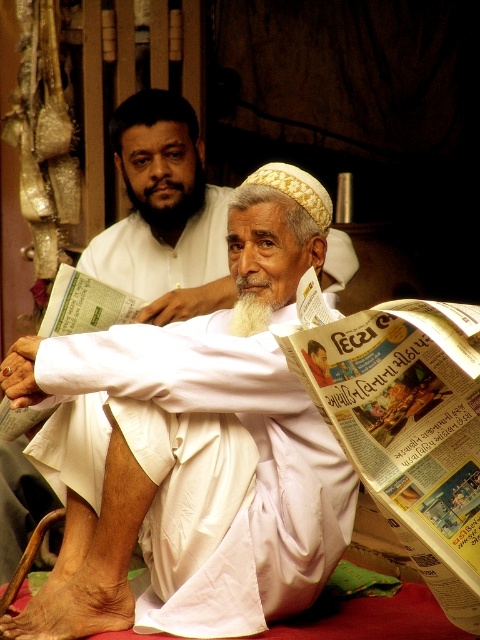
In the scene shown: You are an AI analyzing the image. The black beard at upper center is located at coordinates. What are its coordinates?

The black beard at upper center is located at coordinates point (169, 205).

You are standing at the entrance of the room and want to approach the white clothed man at center. According to the coordinates provided, which direction should you move to reach him?

The white clothed man at center is located at coordinates point (x=180, y=481), which means he is positioned towards the right side of the room. Since you are at the entrance, you should move to your right to reach him.

You are a photographer trying to capture a group photo of the white clothed man at center and the black beard at upper center. Based on their sizes, which one should you position closer to the camera to make them appear similar in size in the photo?

The white clothed man at center has a lesser width compared to the black beard at upper center. To make them appear similar in size in the photo, position the white clothed man at center closer to the camera since smaller objects need to be nearer to appear the same size as larger ones placed farther back.